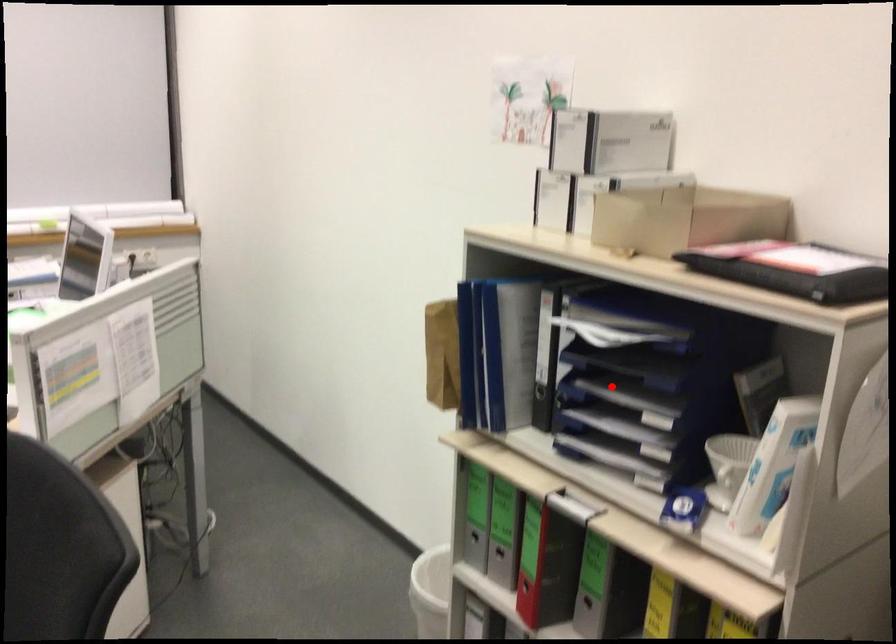
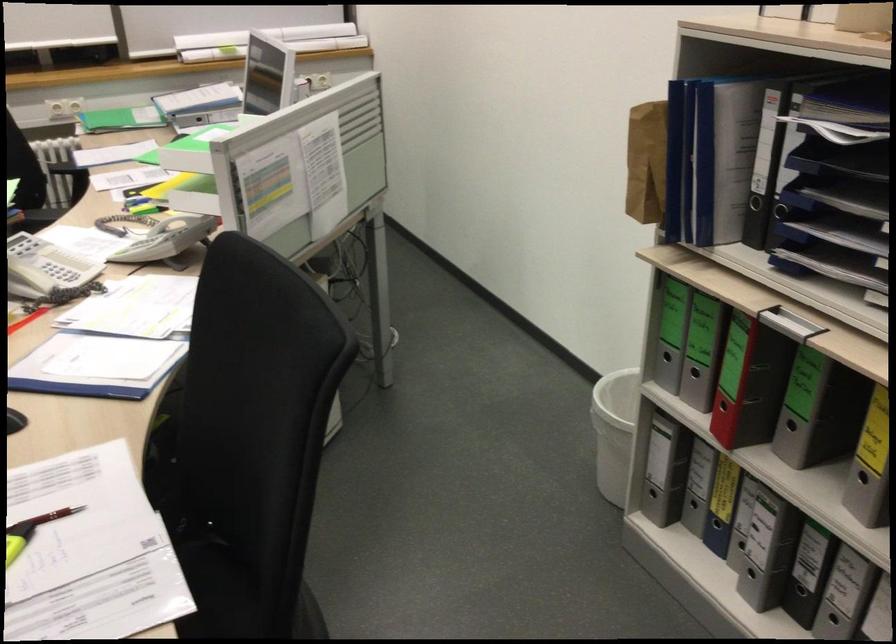
Where in the second image is the point corresponding to the highlighted location from the first image?

(840, 194)